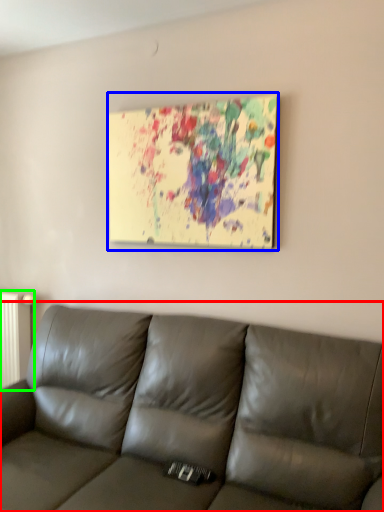
Question: Considering the real-world distances, which object is closest to studio couch (highlighted by a red box)? picture frame (highlighted by a blue box) or radiator (highlighted by a green box).

Choices:
 (A) picture frame
 (B) radiator

Answer: (A)